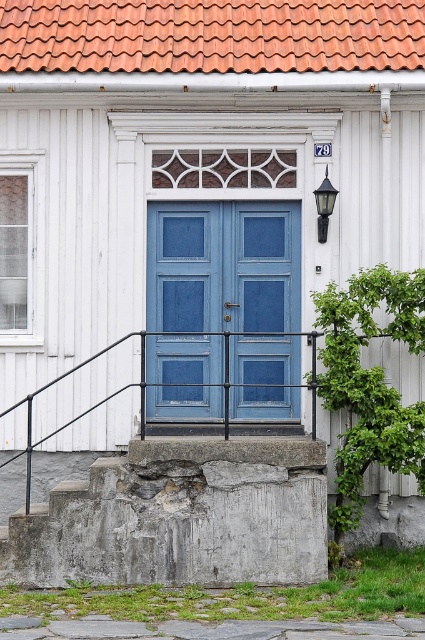
Question: Considering the real-world distances, which object is closest to the black glass lamp at upper right?

Choices:
 (A) blue painted wood door at center
 (B) terracotta clay tiles at upper center
 (C) gray concrete at lower center
 (D) gray rough concrete at lower center

Answer: (A)

Question: Considering the relative positions of gray rough concrete at lower center and terracotta clay tiles at upper center in the image provided, where is gray rough concrete at lower center located with respect to terracotta clay tiles at upper center?

Choices:
 (A) right
 (B) left

Answer: (B)

Question: Among these points, which one is nearest to the camera?

Choices:
 (A) (172, 493)
 (B) (323, 232)
 (C) (226, 234)
 (D) (371, 627)

Answer: (D)

Question: Does blue painted wood door at center appear on the left side of terracotta clay tiles at upper center?

Choices:
 (A) yes
 (B) no

Answer: (B)

Question: Among these objects, which one is farthest from the camera?

Choices:
 (A) terracotta clay tiles at upper center
 (B) gray rough concrete at lower center
 (C) gray concrete at lower center

Answer: (A)

Question: In this image, where is terracotta clay tiles at upper center located relative to gray concrete at lower center?

Choices:
 (A) below
 (B) above

Answer: (B)